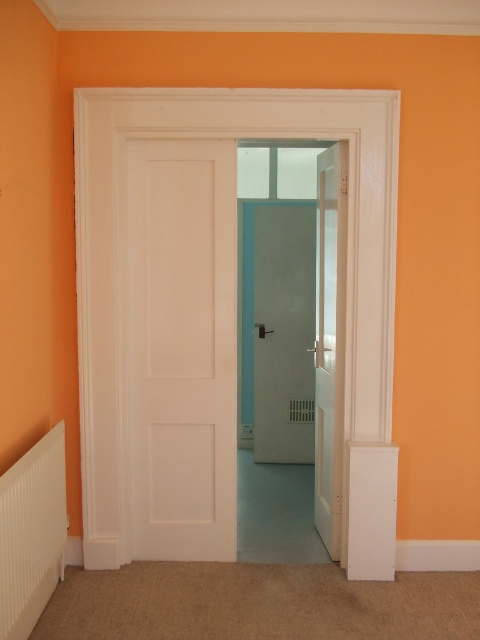
Question: Can you confirm if white glossy door at center is positioned below white plastic radiator at lower left?

Choices:
 (A) yes
 (B) no

Answer: (B)

Question: Is white matte door at center smaller than matte white door at center?

Choices:
 (A) no
 (B) yes

Answer: (B)

Question: Among these points, which one is nearest to the camera?

Choices:
 (A) (294, 264)
 (B) (203, 486)
 (C) (32, 552)

Answer: (C)

Question: Based on their relative distances, which object is nearer to the white matte door at center?

Choices:
 (A) white plastic radiator at lower left
 (B) matte white door at center
 (C) white glossy door at center

Answer: (C)

Question: Does matte white door at center have a greater width compared to white plastic radiator at lower left?

Choices:
 (A) no
 (B) yes

Answer: (B)

Question: Among these objects, which one is nearest to the camera?

Choices:
 (A) white plastic radiator at lower left
 (B) white matte door at center
 (C) matte white door at center

Answer: (A)